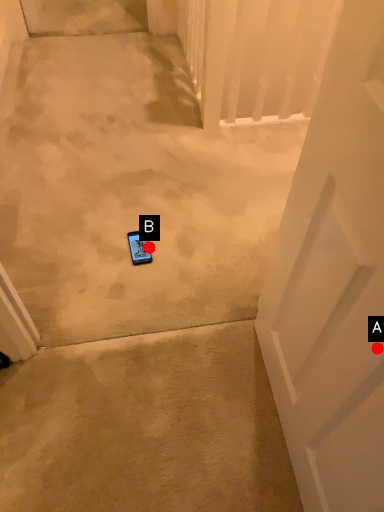
Question: Two points are circled on the image, labeled by A and B beside each circle. Which point is farther from the camera taking this photo?

Choices:
 (A) A is further
 (B) B is further

Answer: (B)